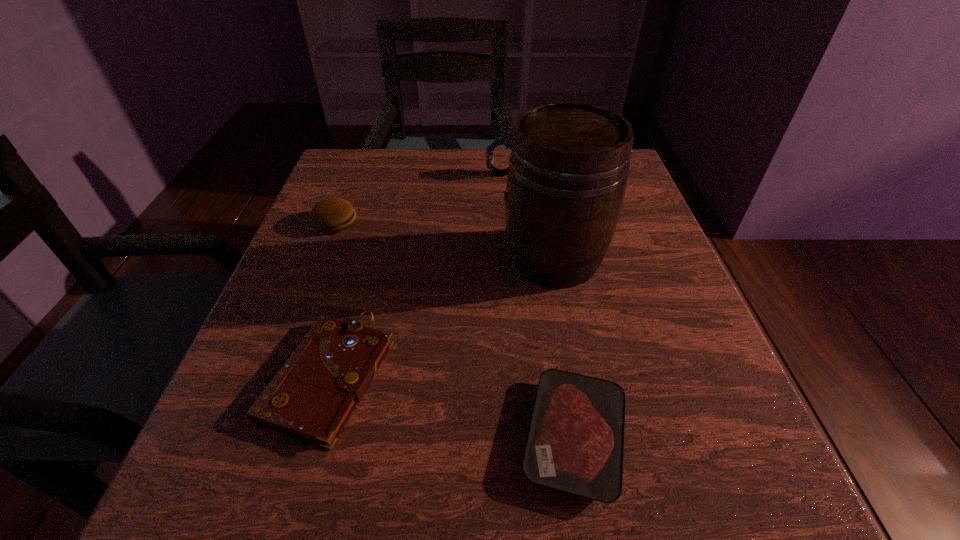
Where is `free space located 0.120m on the face of the watch`? This screenshot has width=960, height=540. free space located 0.120m on the face of the watch is located at coordinates (437, 174).

Locate an element on the screen. This screenshot has height=540, width=960. free space located on the face of the watch is located at coordinates (420, 174).

Find the location of a particular element. The height and width of the screenshot is (540, 960). vacant point located on the right of the third tallest object is located at coordinates (462, 222).

Locate an element on the screen. This screenshot has width=960, height=540. free point located on the back of the notebook is located at coordinates (355, 283).

Identify the location of free space located 0.050m on the right of the shortest object. (668, 436).

Find the location of a particular element. The height and width of the screenshot is (540, 960). object at the far edge is located at coordinates (500, 141).

At what (x,y) coordinates should I click in order to perform the action: click on object present at the near edge. Please return your answer as a coordinate pair (x, y). Image resolution: width=960 pixels, height=540 pixels. Looking at the image, I should click on (575, 444).

Where is `patty at the left edge`? The image size is (960, 540). patty at the left edge is located at coordinates (333, 215).

I want to click on notebook that is positioned at the left edge, so click(313, 395).

You are a GUI agent. You are given a task and a screenshot of the screen. Output one action in this format:
    pyautogui.click(x=<x>, y=<y>)
    Task: Click on the object at the right edge
    The image size is (960, 540).
    Given the screenshot: What is the action you would take?
    pyautogui.click(x=569, y=164)